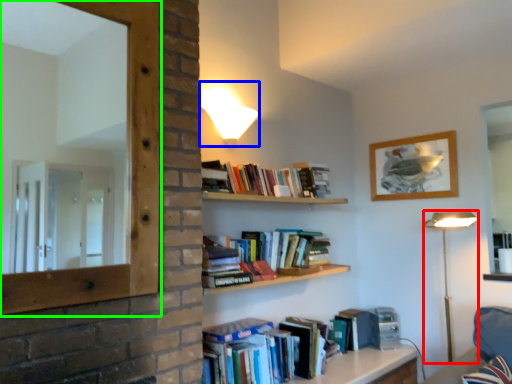
Question: Which is nearer to the table lamp (highlighted by a red box)? lamp (highlighted by a blue box) or window frame (highlighted by a green box).

Choices:
 (A) lamp
 (B) window frame

Answer: (A)